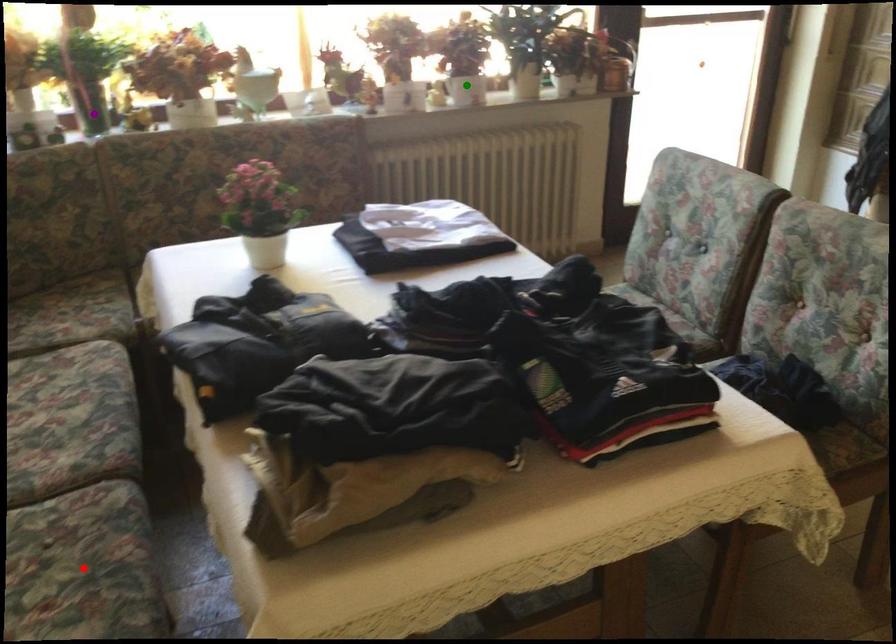
From the picture: Order these from nearest to farthest:
- purple point
- red point
- green point

1. green point
2. purple point
3. red point